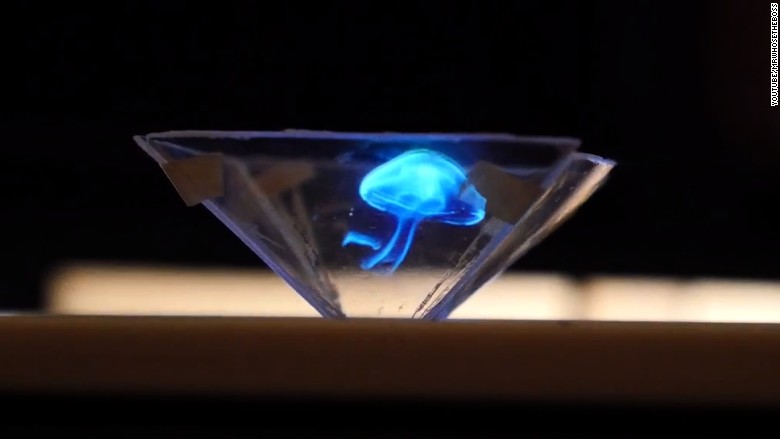
This screenshot has width=780, height=439. In order to click on projection in this screenshot , I will do `click(405, 199)`.